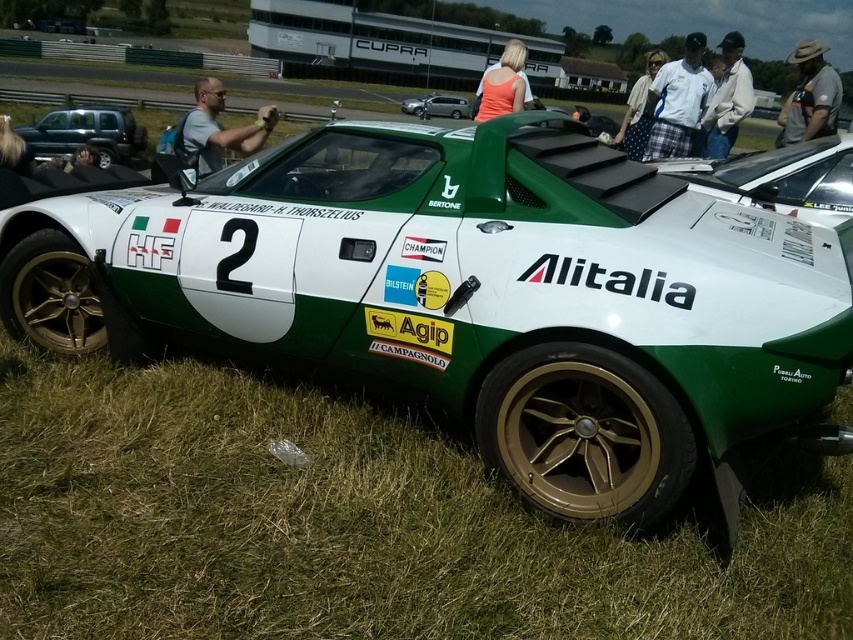
Between matte gray shirt at upper center and metallic silver sedan at center, which one has less height?

Standing shorter between the two is matte gray shirt at upper center.

You are a GUI agent. You are given a task and a screenshot of the screen. Output one action in this format:
    pyautogui.click(x=<x>, y=<y>)
    Task: Click on the matte gray shirt at upper center
    The width and height of the screenshot is (853, 640).
    Given the screenshot: What is the action you would take?
    pyautogui.click(x=219, y=129)

Is plaid fabric shirt at upper center wider than green matte truck at left?

No, plaid fabric shirt at upper center is not wider than green matte truck at left.

What do you see at coordinates (677, 100) in the screenshot? Image resolution: width=853 pixels, height=640 pixels. I see `plaid fabric shirt at upper center` at bounding box center [677, 100].

Is point (682, 115) more distant than point (107, 141)?

No, it is not.

Where is `plaid fabric shirt at upper center`? plaid fabric shirt at upper center is located at coordinates (677, 100).

Is green matte truck at left smaller than metallic silver sedan at center?

No, green matte truck at left is not smaller than metallic silver sedan at center.

Is green matte truck at left taller than metallic silver sedan at center?

Yes, green matte truck at left is taller than metallic silver sedan at center.

Locate an element on the screen. The height and width of the screenshot is (640, 853). green matte truck at left is located at coordinates (86, 134).